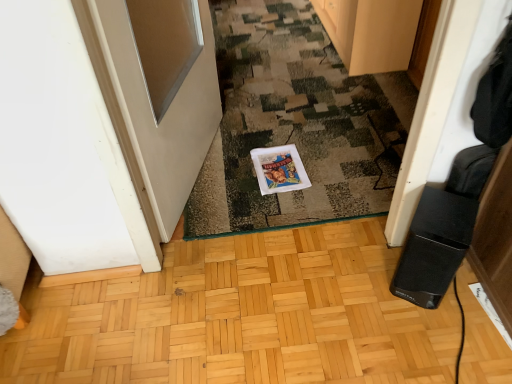
The width and height of the screenshot is (512, 384). What are the coordinates of `free space to the left of wooden cabinet at upper center` in the screenshot? It's located at (277, 39).